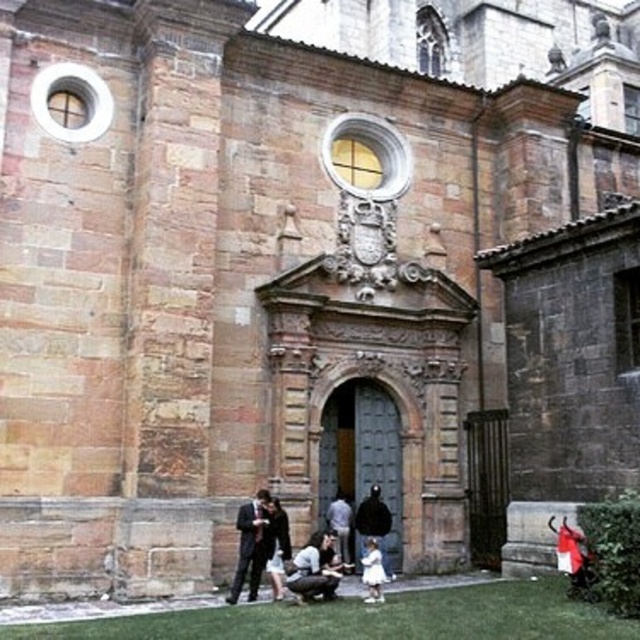
Question: Is green grass at lower center smaller than dark suit at center?

Choices:
 (A) yes
 (B) no

Answer: (B)

Question: Among these points, which one is farthest from the camera?

Choices:
 (A) (278, 582)
 (B) (348, 513)

Answer: (B)

Question: Does matte black jacket at lower center have a lesser width compared to white cotton dress at lower center?

Choices:
 (A) no
 (B) yes

Answer: (A)

Question: Which point appears farthest from the camera in this image?

Choices:
 (A) (56, 634)
 (B) (332, 502)
 (C) (392, 577)
 (D) (364, 580)

Answer: (B)

Question: From the image, what is the correct spatial relationship of dark suit at center in relation to white cotton dress at lower center?

Choices:
 (A) left
 (B) right

Answer: (A)

Question: Which point appears closest to the camera in this image?

Choices:
 (A) (337, 531)
 (B) (356, 600)
 (C) (301, 563)
 (D) (378, 593)

Answer: (D)